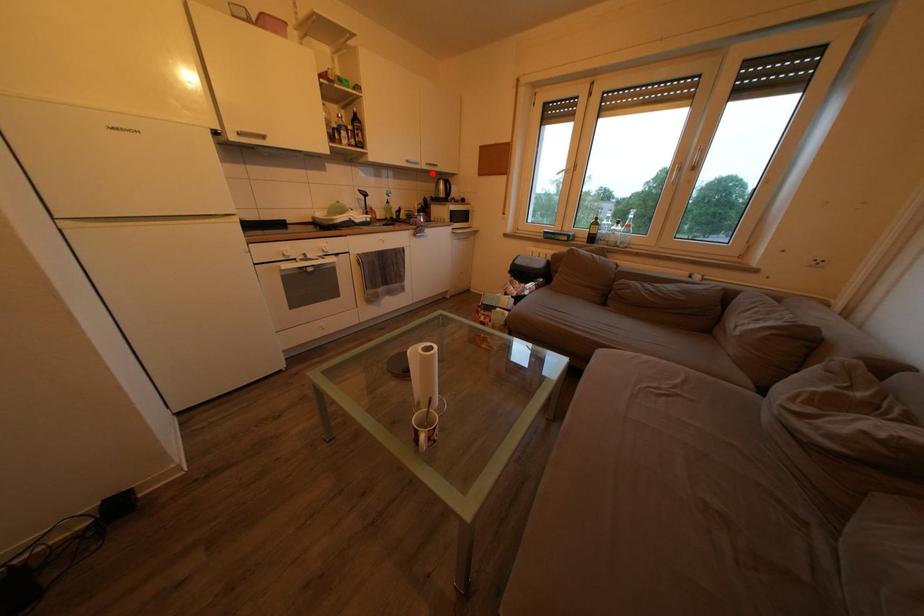
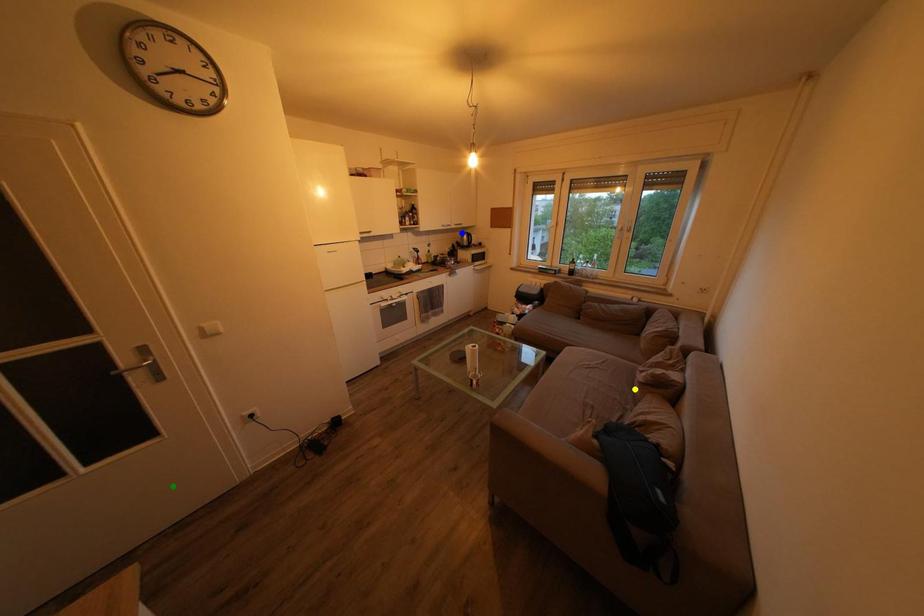
Question: I am providing you with two images of the same scene from different viewpoints. A red point is marked on the first image. You are given multiple points on the second image. Which point in image 2 is actually the same real-world point as the red point in image 1?

Choices:
 (A) green point
 (B) blue point
 (C) yellow point

Answer: (B)